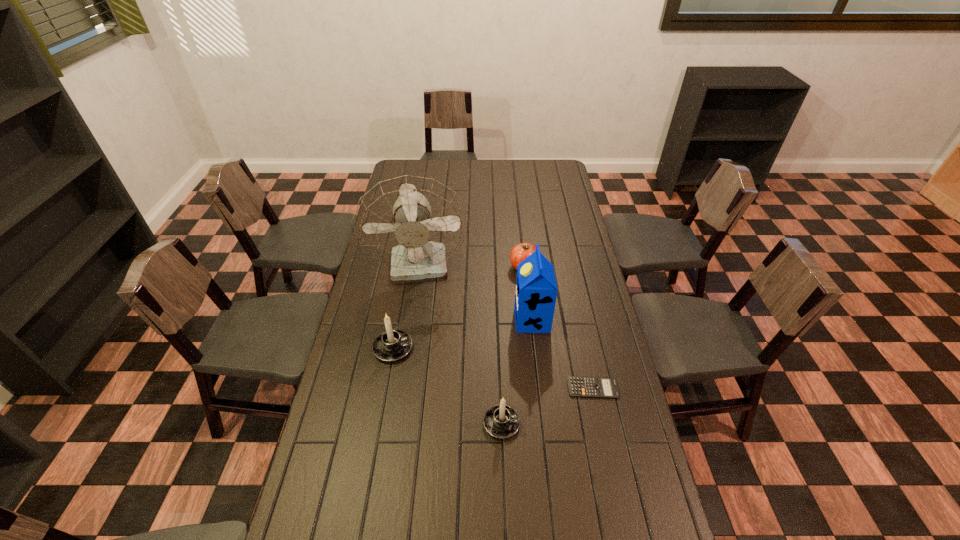
This screenshot has height=540, width=960. In order to click on the left candle holder in this screenshot , I will do `click(392, 345)`.

Find the location of a particular element. the taller candle holder is located at coordinates (392, 345).

I want to click on the nearest object, so pos(501,421).

This screenshot has height=540, width=960. In order to click on the fourth object from right to left in this screenshot , I will do `click(501, 421)`.

The height and width of the screenshot is (540, 960). In order to click on the second shortest object in this screenshot , I will do `click(521, 251)`.

This screenshot has height=540, width=960. In order to click on carton in this screenshot , I will do `click(536, 290)`.

Image resolution: width=960 pixels, height=540 pixels. What are the coordinates of `calculator` in the screenshot? It's located at (596, 387).

Locate an element on the screen. This screenshot has width=960, height=540. the second nearest object is located at coordinates (596, 387).

Find the location of a particular element. Image resolution: width=960 pixels, height=540 pixels. fan is located at coordinates (413, 224).

I want to click on free point located with a handle on the side of the taller candle holder, so click(463, 348).